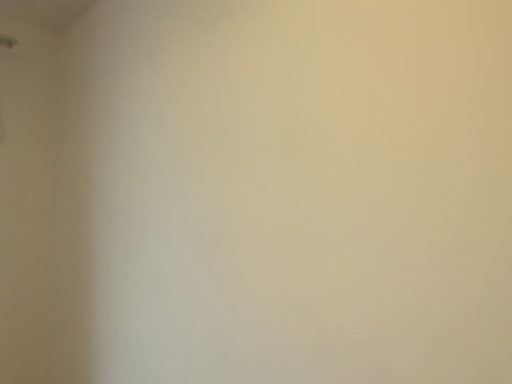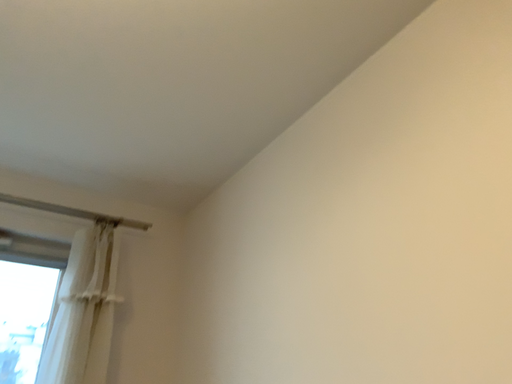
Question: How did the camera likely rotate when shooting the video?

Choices:
 (A) rotated downward
 (B) rotated upward

Answer: (B)